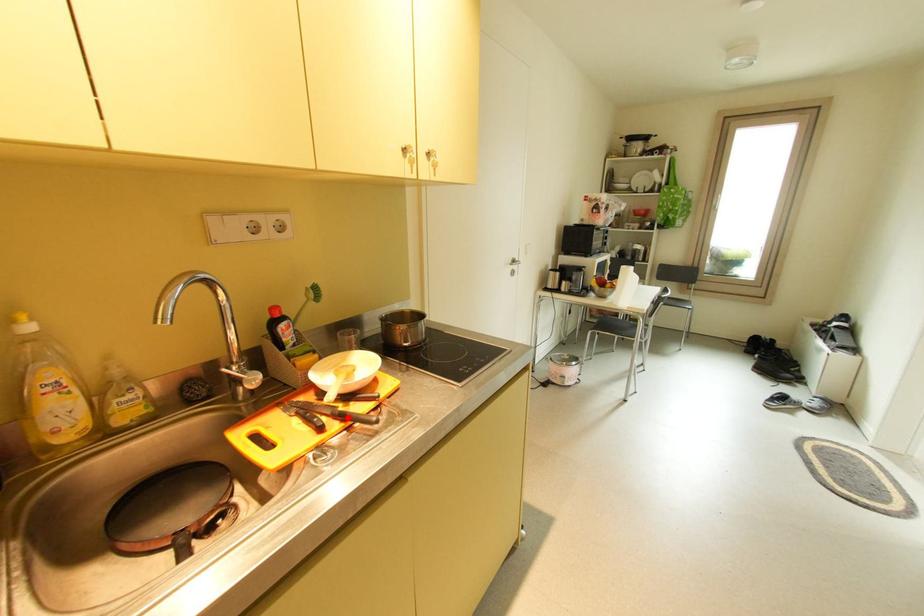
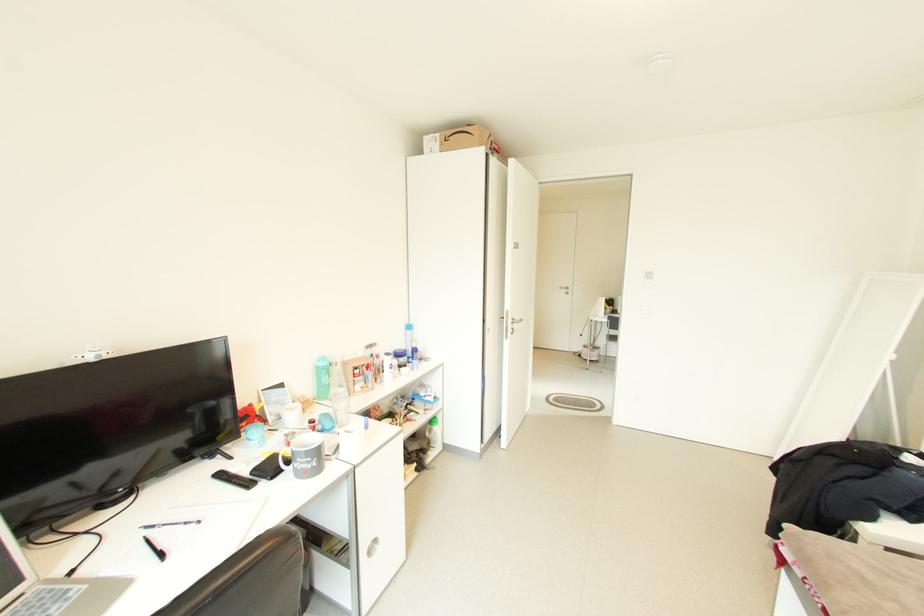
Question: I am providing you with two images of the same scene from different viewpoints. A red point is marked on the first image. Is the red point's position out of view in image 2?

Choices:
 (A) Yes
 (B) No

Answer: (A)